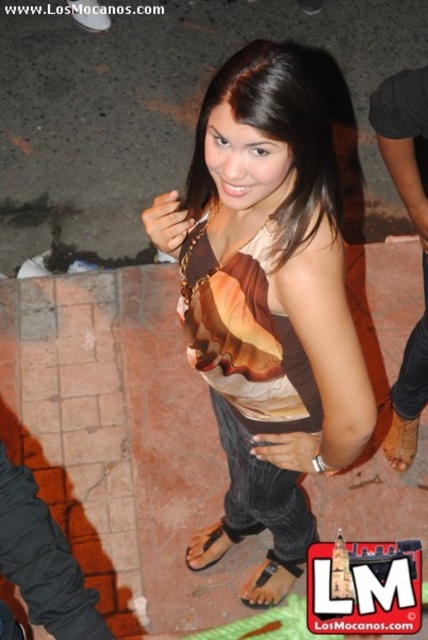
You are a photographer trying to focus on the matte brown tank top at center and the black leather sandal at lower center in the image. Which object should you adjust your camera focus on first if you want to ensure the closest object is in focus?

The matte brown tank top at center is closer to the viewer than the black leather sandal at lower center, so you should focus on the matte brown tank top at center first to ensure it is in focus.

In the scene shown: You are a photographer trying to capture the woman in the scene. If you want to focus on the brown fabric dress at center without the brown leather sandal at lower right appearing in the foreground, where should you position the camera?

Position the camera so that the brown fabric dress at center is centered in the frame and angled slightly downward. This way, the brown leather sandal at lower right will be out of the foreground and not obstruct the view of the dress.